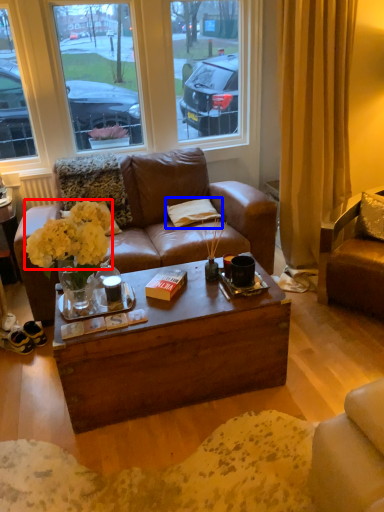
Question: Which point is closer to the camera, flower (highlighted by a red box) or pillow (highlighted by a blue box)?

Choices:
 (A) flower
 (B) pillow

Answer: (A)